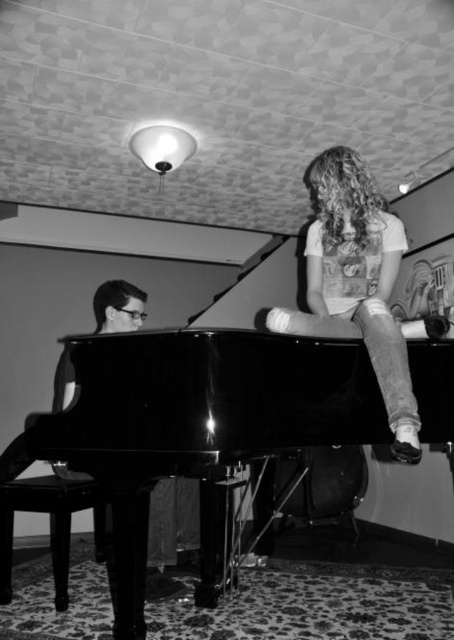
You are a photographer who wants to place a 30 cm wide camera bag between the denim jeans at upper right and the shiny black stool at lower left. Can you fit it there?

The denim jeans at upper right is wider than the shiny black stool at lower left, but the exact width difference isn not specified. However, since the camera bag is 30 cm wide, you need to ensure there is enough space between them. Without knowing the exact distance between the two objects, it is uncertain if the camera bag will fit.